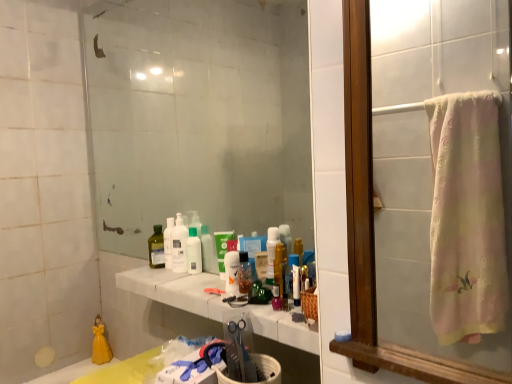
Question: Is pink fabric towel at right, which is counted as the 1th mirror, starting from the front, facing towards white marble counter at center?

Choices:
 (A) yes
 (B) no

Answer: (B)

Question: Does pink fabric towel at right, arranged as the second mirror when viewed from the left, have a smaller size compared to white marble counter at center?

Choices:
 (A) no
 (B) yes

Answer: (A)

Question: From a real-world perspective, is pink fabric towel at right, which is counted as the 1th mirror, starting from the front, physically above white marble counter at center?

Choices:
 (A) no
 (B) yes

Answer: (B)

Question: From the image's perspective, is pink fabric towel at right, which is the 1th mirror in right-to-left order, on top of white marble counter at center?

Choices:
 (A) yes
 (B) no

Answer: (A)

Question: Does pink fabric towel at right, the 2th mirror from the back, have a greater width compared to white marble counter at center?

Choices:
 (A) no
 (B) yes

Answer: (A)

Question: Is translucent plastic mouthwash at center, the first mouthwash from the left, taller or shorter than translucent plastic spray bottle at center, the first cleaning product from the front?

Choices:
 (A) short
 (B) tall

Answer: (A)

Question: Looking at the image, does translucent plastic mouthwash at center, the 3th mouthwash positioned from the front, seem bigger or smaller compared to translucent plastic spray bottle at center, the first cleaning product when ordered from right to left?

Choices:
 (A) big
 (B) small

Answer: (A)

Question: Visually, is translucent plastic mouthwash at center, the first mouthwash from the left, positioned to the left or to the right of translucent plastic spray bottle at center, the first cleaning product when ordered from right to left?

Choices:
 (A) left
 (B) right

Answer: (A)

Question: From the image's perspective, is translucent plastic mouthwash at center, the first mouthwash from the left, located above or below translucent plastic spray bottle at center, the first cleaning product when ordered from right to left?

Choices:
 (A) above
 (B) below

Answer: (B)

Question: Do you think white marble counter at center is within yellow porcelain doll at lower left, or outside of it?

Choices:
 (A) inside
 (B) outside

Answer: (B)

Question: From a real-world perspective, is white marble counter at center physically located above or below yellow porcelain doll at lower left?

Choices:
 (A) above
 (B) below

Answer: (A)

Question: From the image's perspective, is white marble counter at center positioned above or below yellow porcelain doll at lower left?

Choices:
 (A) above
 (B) below

Answer: (A)

Question: Looking at the image, does white marble counter at center seem bigger or smaller compared to yellow porcelain doll at lower left?

Choices:
 (A) small
 (B) big

Answer: (B)

Question: Is white marble counter at center taller or shorter than translucent plastic mouthwash at center, the 3th mouthwash positioned from the front?

Choices:
 (A) short
 (B) tall

Answer: (A)

Question: In terms of width, does white marble counter at center look wider or thinner when compared to translucent plastic mouthwash at center, marked as the first mouthwash in a back-to-front arrangement?

Choices:
 (A) thin
 (B) wide

Answer: (B)